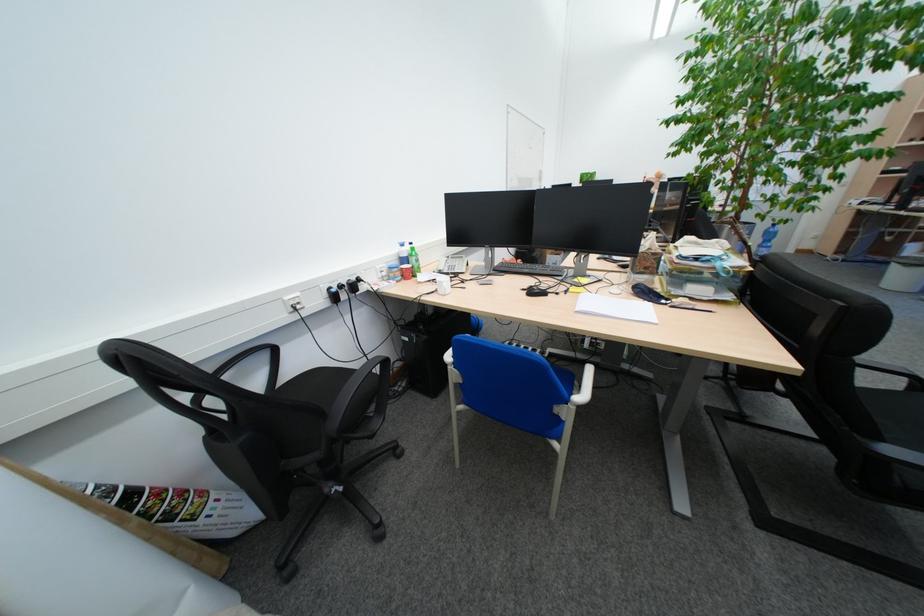
Image resolution: width=924 pixels, height=616 pixels. I want to click on black chair sitting surface, so click(314, 386).